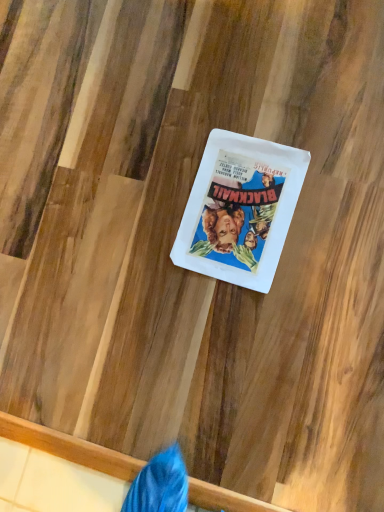
Find the location of a particular element. The image size is (384, 512). vacant area on top of white paper at center (from a real-world perspective) is located at coordinates (238, 210).